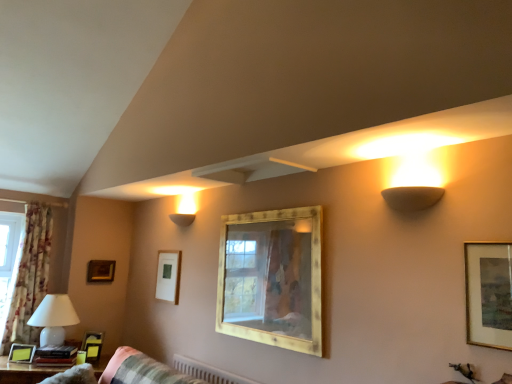
Question: Considering the positions of matte yellow picture frame at lower left, positioned as the fourth picture frame in back-to-front order, and wooden frame at upper left, which is counted as the sixth picture frame, starting from the front, in the image, is matte yellow picture frame at lower left, positioned as the fourth picture frame in back-to-front order, wider or thinner than wooden frame at upper left, which is counted as the sixth picture frame, starting from the front,?

Choices:
 (A) wide
 (B) thin

Answer: (B)

Question: Is matte yellow picture frame at lower left, the first picture frame viewed from the left, inside or outside of wooden frame at upper left, which is counted as the sixth picture frame, starting from the front?

Choices:
 (A) outside
 (B) inside

Answer: (A)

Question: Considering the real-world distances, which object is farthest from the gold-framed picture at right, which is counted as the 1th picture frame, starting from the front?

Choices:
 (A) floral fabric curtain at left
 (B) wooden table at lower left
 (C) wooden mirror at center, the second picture frame from the right
 (D) matte black picture frame at lower left, which ranks as the 4th picture frame in right-to-left order
 (E) matte yellow picture frame at lower left, positioned as the fourth picture frame in back-to-front order

Answer: (A)

Question: Which of these objects is positioned farthest from the matte beige wall sconce at upper right, which is the 2th lamp from left to right?

Choices:
 (A) floral fabric curtain at left
 (B) matte white picture frame at center-left, acting as the 2th picture frame starting from the back
 (C) gold-framed picture at right, positioned as the 6th picture frame in back-to-front order
 (D) matte yellow picture frame at lower left, marked as the sixth picture frame in a right-to-left arrangement
 (E) wooden frame at upper left, the fifth picture frame when ordered from right to left

Answer: (A)